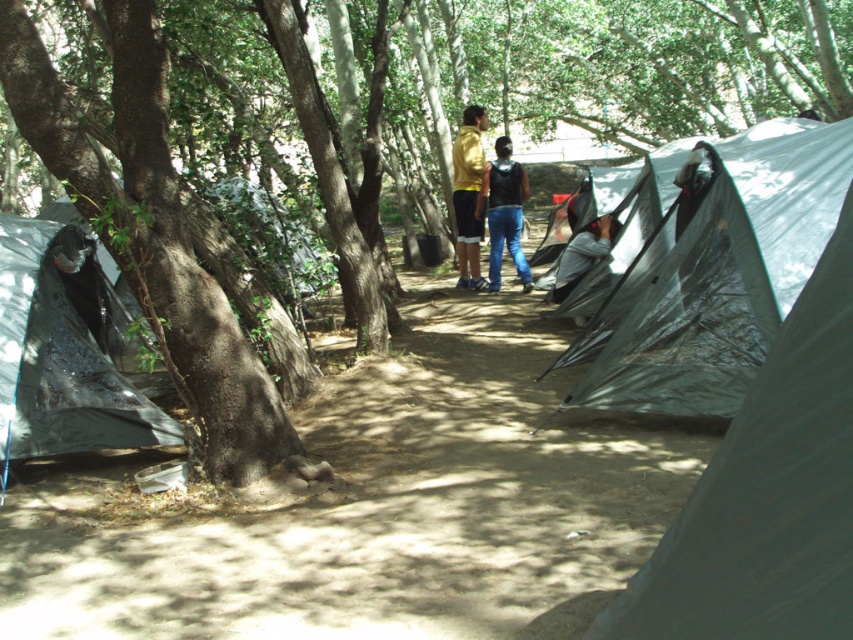
You are standing at the point marked by the coordinates point [149,230]. Which object are you standing at?

You are standing at the green rough bark tree at left.

Based on the photo, you are standing at the center of the camping area. You want to locate the transparent plastic tent at right. According to the coordinates provided, in which direction should you move relative to your current position?

The transparent plastic tent at right is located at point (x=715, y=280). Since you are at the center, you should move towards the right direction to reach it.